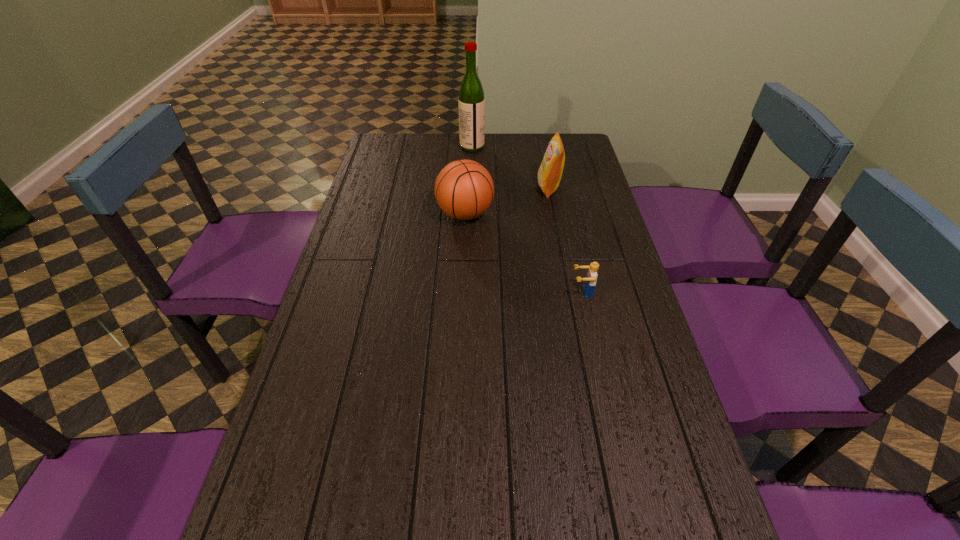
The width and height of the screenshot is (960, 540). What are the coordinates of `the farthest object` in the screenshot? It's located at (471, 102).

Image resolution: width=960 pixels, height=540 pixels. I want to click on the tallest object, so click(471, 102).

The width and height of the screenshot is (960, 540). Find the location of `basketball`. basketball is located at coordinates (464, 189).

I want to click on crisp (potato chip), so click(549, 175).

This screenshot has width=960, height=540. In order to click on the shortest object in this screenshot , I will do `click(590, 281)`.

Identify the location of the nearest object. This screenshot has height=540, width=960. (590, 281).

At what (x,y) coordinates should I click in order to perform the action: click on free spot located on the label of the tallest object. Please return your answer as a coordinate pair (x, y). This screenshot has height=540, width=960. Looking at the image, I should click on (496, 147).

The height and width of the screenshot is (540, 960). In order to click on free space located 0.210m on the right of the basketball in this screenshot , I will do `click(555, 214)`.

You are a GUI agent. You are given a task and a screenshot of the screen. Output one action in this format:
    pyautogui.click(x=<x>, y=<y>)
    Task: Click on the free space located on the front-facing side of the crisp (potato chip)
    Image resolution: width=960 pixels, height=540 pixels.
    Given the screenshot: What is the action you would take?
    pyautogui.click(x=450, y=188)

Identify the location of free region located on the front-facing side of the crisp (potato chip). (437, 188).